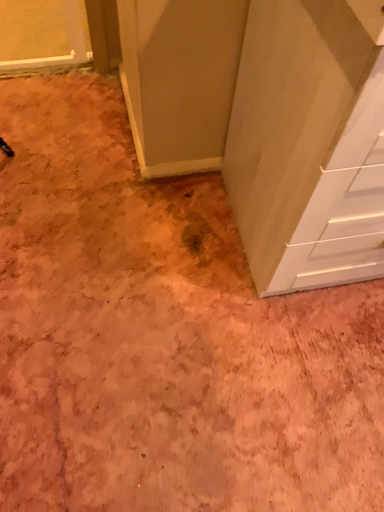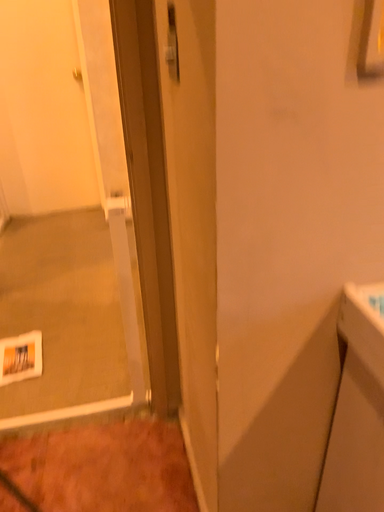
Question: How did the camera likely rotate when shooting the video?

Choices:
 (A) rotated downward
 (B) rotated upward

Answer: (B)